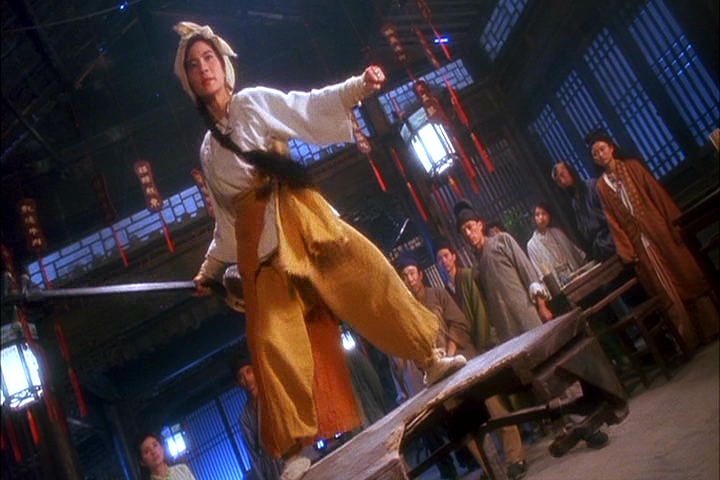
Locate an element on the screen. This screenshot has width=720, height=480. chinese lanterns is located at coordinates pyautogui.click(x=415, y=145), pyautogui.click(x=18, y=375).